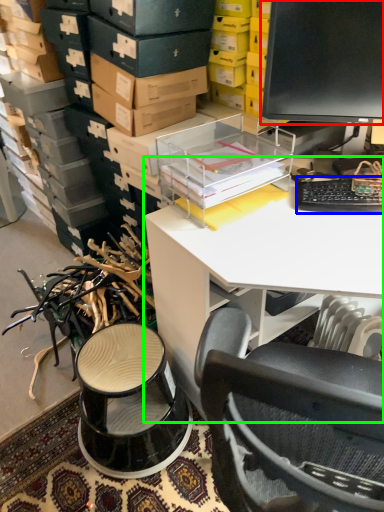
Question: Which object is positioned farthest from computer monitor (highlighted by a red box)? Select from computer keyboard (highlighted by a blue box) and desk (highlighted by a green box).

Choices:
 (A) computer keyboard
 (B) desk

Answer: (B)